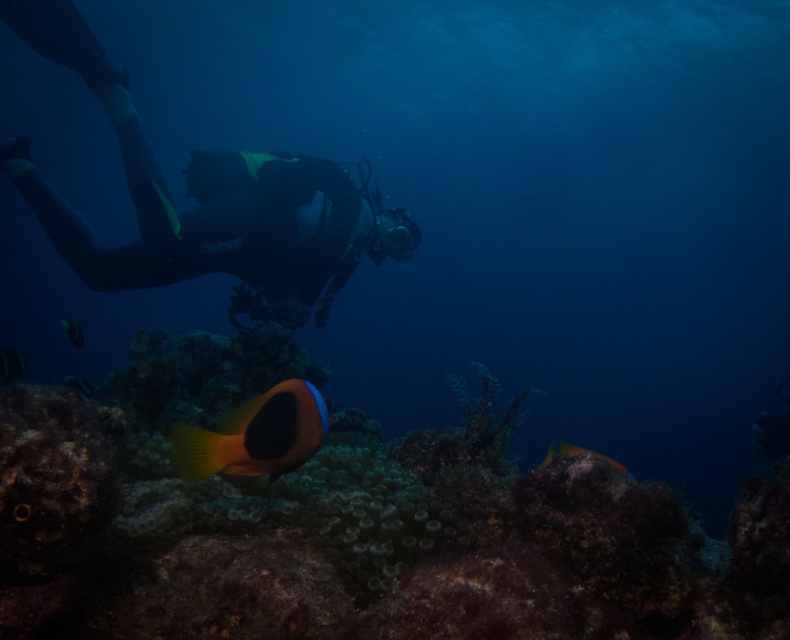
You are a marine biologist analyzing the underwater scene. You observe two points marked in the image. Which point is closer to you, point 1 at coordinates point (661, 520) or point 2 at coordinates point (621, 465)?

Point 1 at coordinates point (661, 520) is closer to you than point 2 at coordinates point (621, 465).

You are a scuba diver preparing to take a photo of the translucent green coral reef at center. Your camera has a maximum focus range of 1.5 meters. Can you capture the reef clearly without moving closer?

The translucent green coral reef at center is 1.53 meters from viewer, which is slightly beyond the camera maximum focus range of 1.5 meters. Therefore, you cannot capture the reef clearly without moving closer.